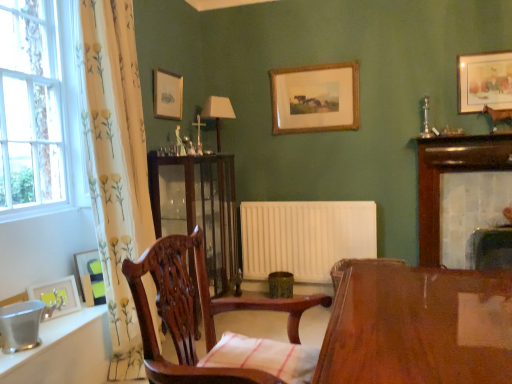
I want to click on empty space that is ontop of white matte radiator at center (from a real-world perspective), so click(297, 200).